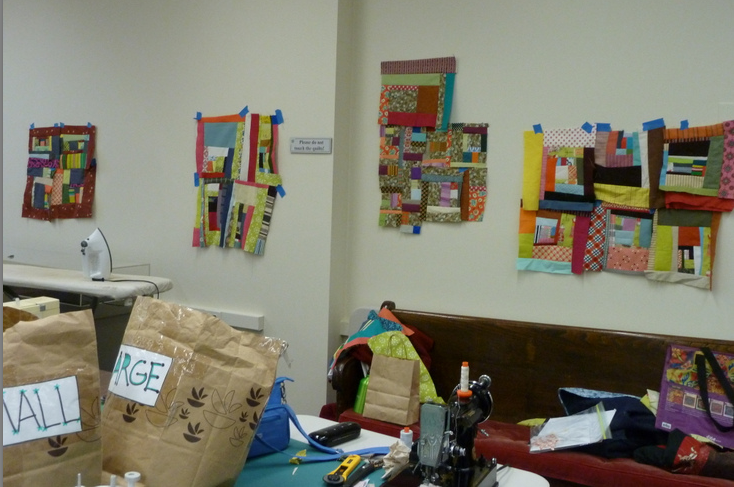
Where is `iron board`? iron board is located at coordinates point(58,277).